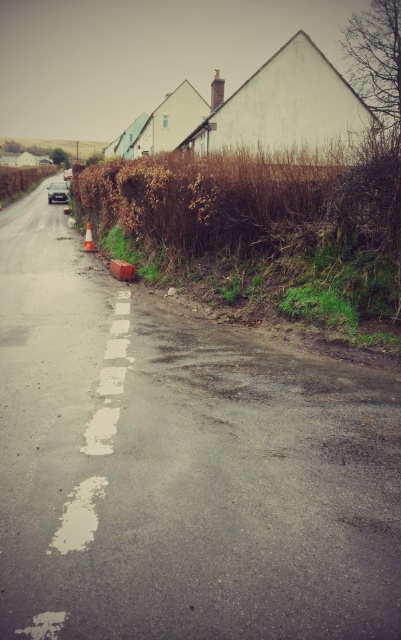
You are driving along the rural road and see the brown dry hedge at left and the orange reflective cone at lower center. Which object is closer to the center of the road?

The orange reflective cone at lower center is closer to the center of the road because it is positioned to the right of the brown dry hedge at left.

You are a delivery driver planning to park your truck on the rural road shown in the image. The truck requires a parking space of at least 25 meters in length. Based on the distance between the brown dry hedge at upper right and the brown dry hedge at left, can you safely park your truck there?

The distance between the brown dry hedge at upper right and the brown dry hedge at left is 27.74 meters, which is longer than the required 25 meters. Therefore, you can safely park your truck in this space.